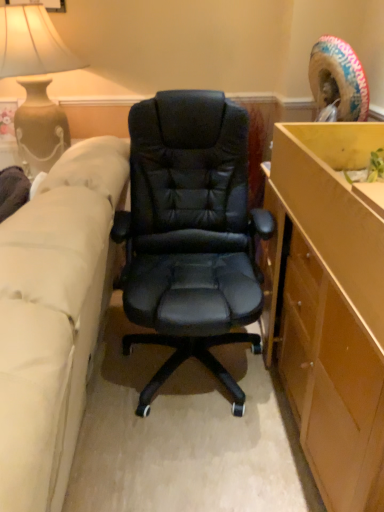
Question: Is beige fabric couch at left bigger or smaller than matte beige vase at upper left?

Choices:
 (A) small
 (B) big

Answer: (B)

Question: Visually, is beige fabric couch at left positioned to the left or to the right of matte beige vase at upper left?

Choices:
 (A) left
 (B) right

Answer: (B)

Question: Is beige fabric couch at left taller or shorter than matte beige vase at upper left?

Choices:
 (A) tall
 (B) short

Answer: (A)

Question: Considering the positions of matte beige vase at upper left and beige fabric couch at left in the image, is matte beige vase at upper left taller or shorter than beige fabric couch at left?

Choices:
 (A) short
 (B) tall

Answer: (A)

Question: Considering the positions of matte beige vase at upper left and beige fabric couch at left in the image, is matte beige vase at upper left wider or thinner than beige fabric couch at left?

Choices:
 (A) wide
 (B) thin

Answer: (B)

Question: Relative to beige fabric couch at left, is matte beige vase at upper left in front or behind?

Choices:
 (A) behind
 (B) front

Answer: (A)

Question: Choose the correct answer: Is matte beige vase at upper left inside beige fabric couch at left or outside it?

Choices:
 (A) outside
 (B) inside

Answer: (A)